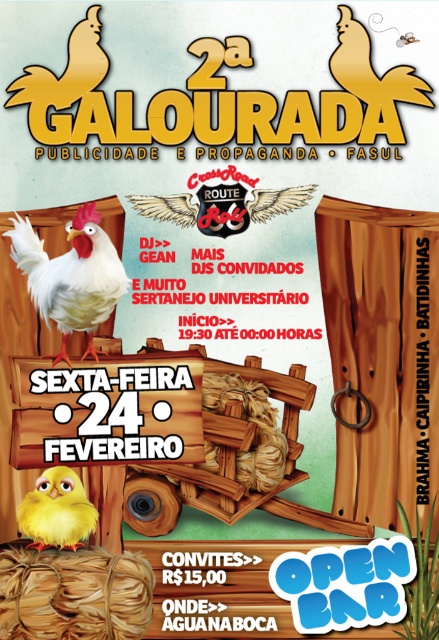
In the scene shown: You are designing a promotional poster and need to place a small sticker on the white matte chicken at center and the yellow matte chick at lower left. Which object will the sticker appear larger on when viewed from the same distance?

The sticker will appear larger on the white matte chicken at center because it is bigger than the yellow matte chick at lower left.

You are designing a layout for a promotional poster and need to place two elements. The white matte chicken at center and the yellow matte chick at lower left. If you want to ensure that the chicken is visually dominant, which object should be larger in size?

The white matte chicken at center should be larger since its width surpasses the yellow matte chick at lower left, making it visually dominant.